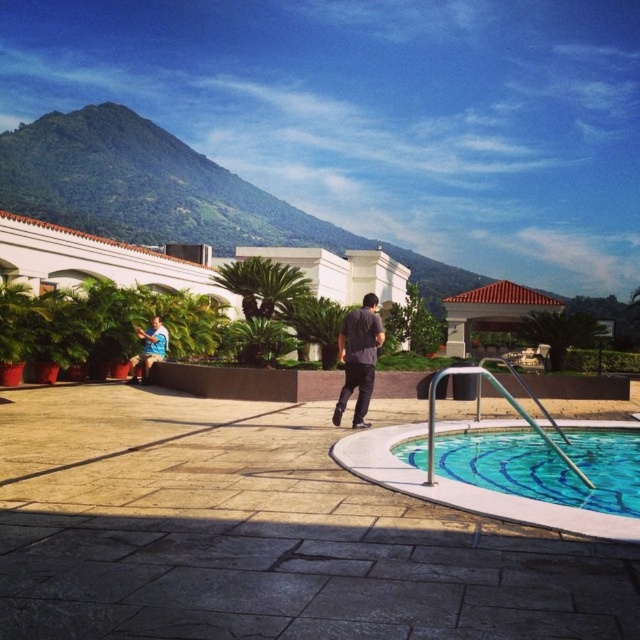
Question: Observing the image, what is the correct spatial positioning of dark gray shirt at center in reference to blue shirt at lower left?

Choices:
 (A) above
 (B) below

Answer: (B)

Question: Is clear glass pool at lower right to the left of blue shirt at lower left from the viewer's perspective?

Choices:
 (A) no
 (B) yes

Answer: (A)

Question: Estimate the real-world distances between objects in this image. Which object is farther from the clear glass pool at lower right?

Choices:
 (A) blue shirt at lower left
 (B) dark gray shirt at center

Answer: (A)

Question: Is clear glass pool at lower right smaller than blue shirt at lower left?

Choices:
 (A) no
 (B) yes

Answer: (B)

Question: Among these points, which one is farthest from the camera?

Choices:
 (A) (465, 445)
 (B) (340, 406)
 (C) (132, 376)

Answer: (C)

Question: Among these points, which one is nearest to the camera?

Choices:
 (A) (355, 356)
 (B) (154, 362)

Answer: (A)